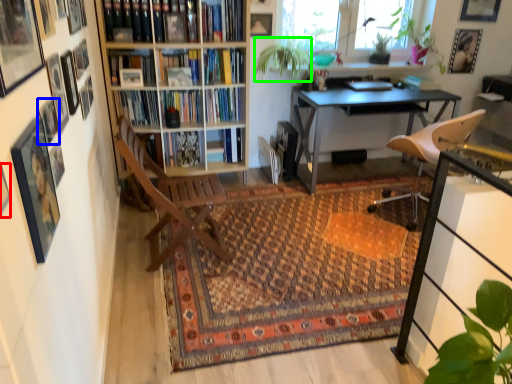
Question: Based on their relative distances, which object is nearer to picture frame (highlighted by a red box)? Choose from picture frame (highlighted by a blue box) and plant (highlighted by a green box).

Choices:
 (A) picture frame
 (B) plant

Answer: (A)